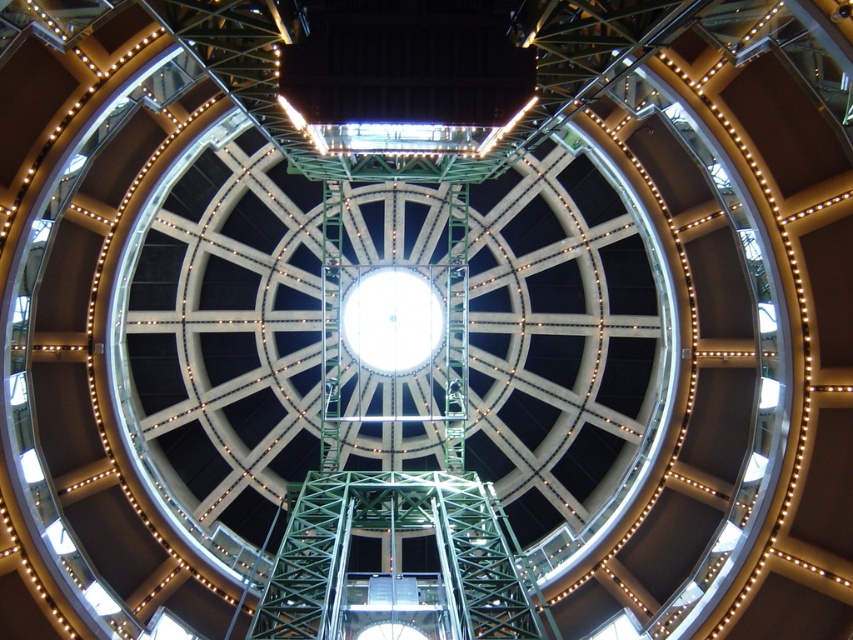
Question: Which object appears farthest from the camera in this image?

Choices:
 (A) white glass clock at center
 (B) green metallic structure at center

Answer: (A)

Question: Is green metallic structure at center behind white glass clock at center?

Choices:
 (A) no
 (B) yes

Answer: (A)

Question: Is green metallic structure at center wider than white glass clock at center?

Choices:
 (A) yes
 (B) no

Answer: (A)

Question: Can you confirm if green metallic structure at center is smaller than white glass clock at center?

Choices:
 (A) no
 (B) yes

Answer: (A)